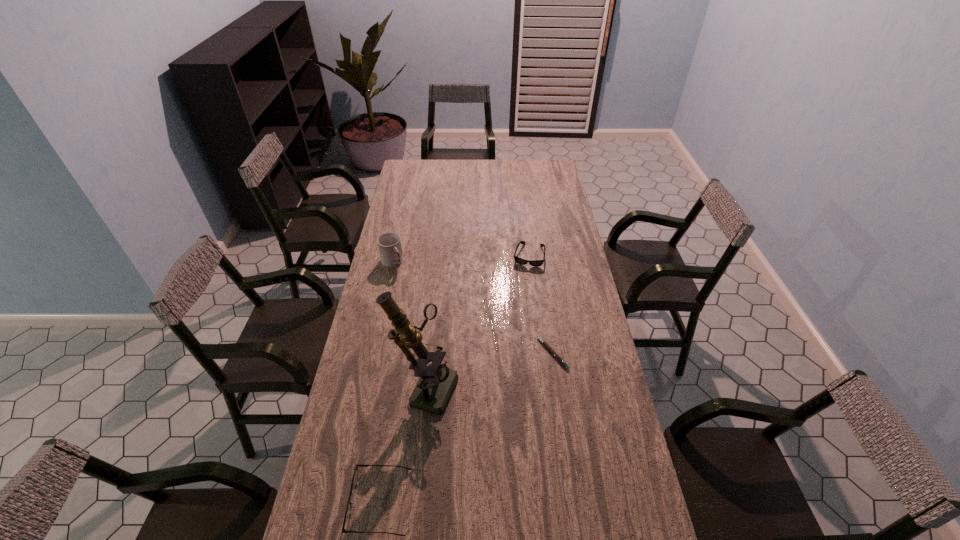
Identify the location of free space located 0.170m at the eyepiece of the microscope. The height and width of the screenshot is (540, 960). (505, 410).

I want to click on vacant space positioned 0.190m at the eyepiece of the microscope, so click(x=512, y=411).

The height and width of the screenshot is (540, 960). What are the coordinates of `vacant space located 0.110m on the side of the cup where the handle is located` in the screenshot? It's located at (409, 285).

In order to click on vacant space located 0.150m on the side of the cup where the handle is located in this screenshot , I will do `click(413, 291)`.

Identify the location of vacant space located 0.160m on the side of the cup where the handle is located. This screenshot has height=540, width=960. (415, 292).

In order to click on vacant space located on the front-facing side of the sunglasses in this screenshot , I will do `click(513, 329)`.

Find the location of a particular element. Image resolution: width=960 pixels, height=540 pixels. free region located 0.320m on the front-facing side of the sunglasses is located at coordinates (515, 322).

Identify the location of free space located 0.220m on the front-facing side of the sunglasses. (518, 303).

Identify the location of object located in the near edge section of the desktop. (355, 475).

Image resolution: width=960 pixels, height=540 pixels. In order to click on spectacles located in the left edge section of the desktop in this screenshot , I will do `click(355, 475)`.